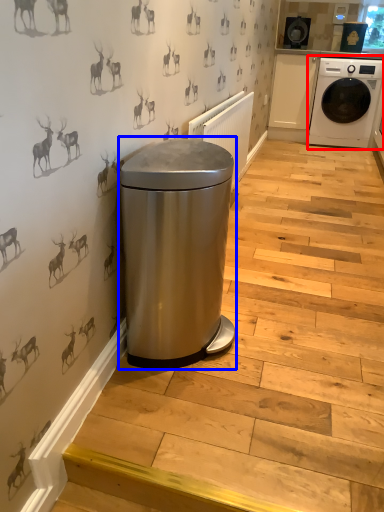
Question: Which object is further to the camera taking this photo, washing machine (highlighted by a red box) or water heater (highlighted by a blue box)?

Choices:
 (A) washing machine
 (B) water heater

Answer: (A)